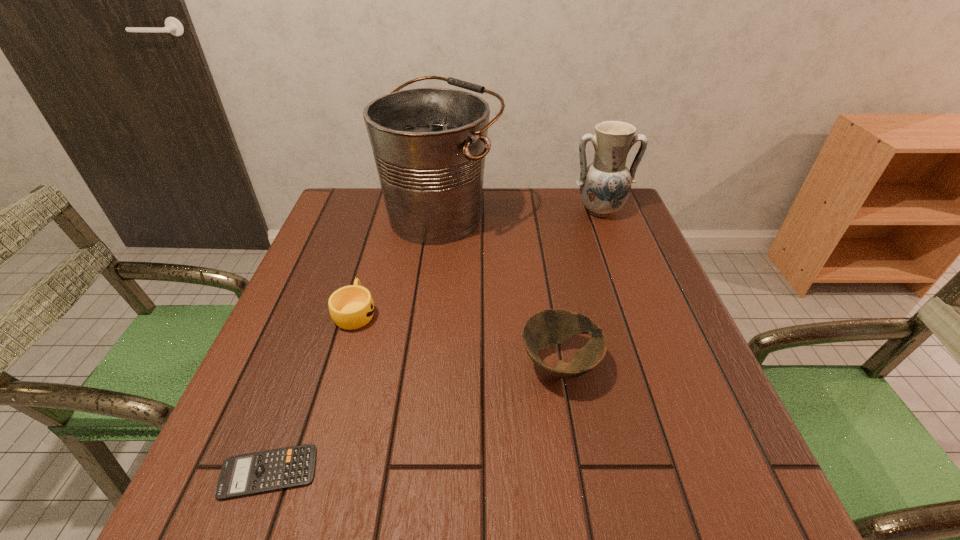
At what (x,y) coordinates should I click in order to perform the action: click on the tallest object. Please return your answer as a coordinate pair (x, y). Looking at the image, I should click on (429, 144).

At what (x,y) coordinates should I click in order to perform the action: click on pottery. Please return your answer as a coordinate pair (x, y). Looking at the image, I should click on (605, 185).

At what (x,y) coordinates should I click in order to perform the action: click on the rightmost object. Please return your answer as a coordinate pair (x, y). Looking at the image, I should click on (605, 185).

Find the location of `the third tallest object`. the third tallest object is located at coordinates (542, 330).

Where is `bowl`? bowl is located at coordinates (542, 330).

Locate an element on the screen. This screenshot has width=960, height=540. the third nearest object is located at coordinates (351, 307).

Where is `the second shortest object`? the second shortest object is located at coordinates (351, 307).

Where is `the nearest object`? The width and height of the screenshot is (960, 540). the nearest object is located at coordinates (259, 472).

Identify the location of the shortest object. This screenshot has width=960, height=540. (x=259, y=472).

Image resolution: width=960 pixels, height=540 pixels. Identify the location of vacant region located on the right of the bucket. (589, 215).